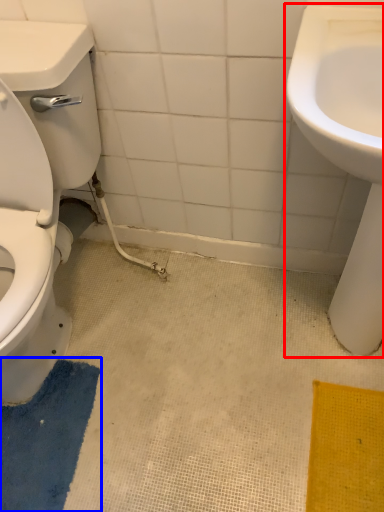
Question: Which object appears farthest to the camera in this image, sink (highlighted by a red box) or bath mat (highlighted by a blue box)?

Choices:
 (A) sink
 (B) bath mat

Answer: (B)